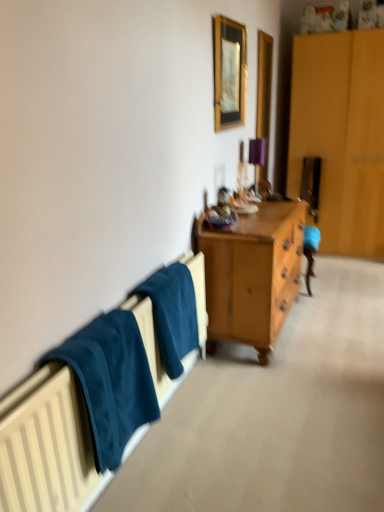
Describe the element at coordinates (111, 382) in the screenshot. This screenshot has height=512, width=384. I see `dark blue fabric at left` at that location.

Where is `dark blue fabric at left`? The width and height of the screenshot is (384, 512). dark blue fabric at left is located at coordinates tap(111, 382).

Can you confirm if dark blue fabric at left is positioned to the right of teal fabric towel at lower left?

No.

Is dark blue fabric at left not within teal fabric towel at lower left?

Indeed, dark blue fabric at left is completely outside teal fabric towel at lower left.

Based on the photo, could you tell me if dark blue fabric at left is turned towards teal fabric towel at lower left?

No, dark blue fabric at left is not oriented towards teal fabric towel at lower left.

Is point (85, 374) in front of point (176, 321)?

Yes, it is.

Would you say wooden picture frame at upper center contains teal fabric towel at lower left?

That's incorrect, teal fabric towel at lower left is not inside wooden picture frame at upper center.

Is wooden picture frame at upper center with teal fabric towel at lower left?

There is a gap between wooden picture frame at upper center and teal fabric towel at lower left.

From a real-world perspective, which object stands above the other?

wooden picture frame at upper center is physically above.

Is wooden picture frame at upper center positioned with its back to teal fabric towel at lower left?

No, wooden picture frame at upper center's orientation is not away from teal fabric towel at lower left.

Consider the image. From a real-world perspective, which object rests below the other?

dark blue fabric at left is physically lower.

Is dark blue fabric at left located within teal fabric towel at lower left?

No.

Looking at this image, does teal fabric towel at lower left lie behind dark blue fabric at left?

Yes, it is behind dark blue fabric at left.

Is dark blue fabric at left looking in the opposite direction of wooden picture frame at upper center?

dark blue fabric at left is not turned away from wooden picture frame at upper center.

Considering the relative positions of dark blue fabric at left and wooden picture frame at upper center in the image provided, is dark blue fabric at left behind wooden picture frame at upper center?

No, it is not.

Considering the points (133, 338) and (240, 122), which point is behind, point (133, 338) or point (240, 122)?

Point (240, 122)

The image size is (384, 512). Find the location of `towel/napkin located below the wooden picture frame at upper center (from the image's perspective)`. towel/napkin located below the wooden picture frame at upper center (from the image's perspective) is located at coordinates (111, 382).

Is wooden picture frame at upper center completely or partially outside of dark blue fabric at left?

Yes, wooden picture frame at upper center is not within dark blue fabric at left.

Which of these two, wooden picture frame at upper center or dark blue fabric at left, is wider?

dark blue fabric at left.

From a real-world perspective, is wooden picture frame at upper center physically above dark blue fabric at left?

Correct, in the physical world, wooden picture frame at upper center is higher than dark blue fabric at left.

From a real-world perspective, is teal fabric towel at lower left above or below wooden picture frame at upper center?

In terms of real-world spatial position, teal fabric towel at lower left is below wooden picture frame at upper center.

Could you tell me if teal fabric towel at lower left is turned towards wooden picture frame at upper center?

No, teal fabric towel at lower left is not aimed at wooden picture frame at upper center.

Is teal fabric towel at lower left taller than wooden picture frame at upper center?

In fact, teal fabric towel at lower left may be shorter than wooden picture frame at upper center.

The height and width of the screenshot is (512, 384). I want to click on towel/napkin below the teal fabric towel at lower left (from the image's perspective), so click(x=111, y=382).

This screenshot has width=384, height=512. In order to click on picture frame behind the teal fabric towel at lower left in this screenshot , I will do `click(229, 72)`.

From the image, which object appears to be nearer to teal fabric towel at lower left, dark blue fabric at left or wooden picture frame at upper center?

The object closer to teal fabric towel at lower left is dark blue fabric at left.

Estimate the real-world distances between objects in this image. Which object is closer to wooden picture frame at upper center, dark blue fabric at left or teal fabric towel at lower left?

Based on the image, teal fabric towel at lower left appears to be nearer to wooden picture frame at upper center.

Looking at the image, which one is located further to dark blue fabric at left, wooden picture frame at upper center or teal fabric towel at lower left?

wooden picture frame at upper center.

From the picture: Based on their spatial positions, is teal fabric towel at lower left or dark blue fabric at left further from wooden picture frame at upper center?

Based on the image, dark blue fabric at left appears to be further to wooden picture frame at upper center.

Looking at the image, which one is located closer to teal fabric towel at lower left, wooden picture frame at upper center or dark blue fabric at left?

dark blue fabric at left lies closer to teal fabric towel at lower left than the other object.

Which object lies further to the anchor point dark blue fabric at left, teal fabric towel at lower left or wooden picture frame at upper center?

Based on the image, wooden picture frame at upper center appears to be further to dark blue fabric at left.

Find the location of a particular element. This screenshot has width=384, height=512. bath towel between wooden picture frame at upper center and dark blue fabric at left in the up-down direction is located at coordinates (172, 314).